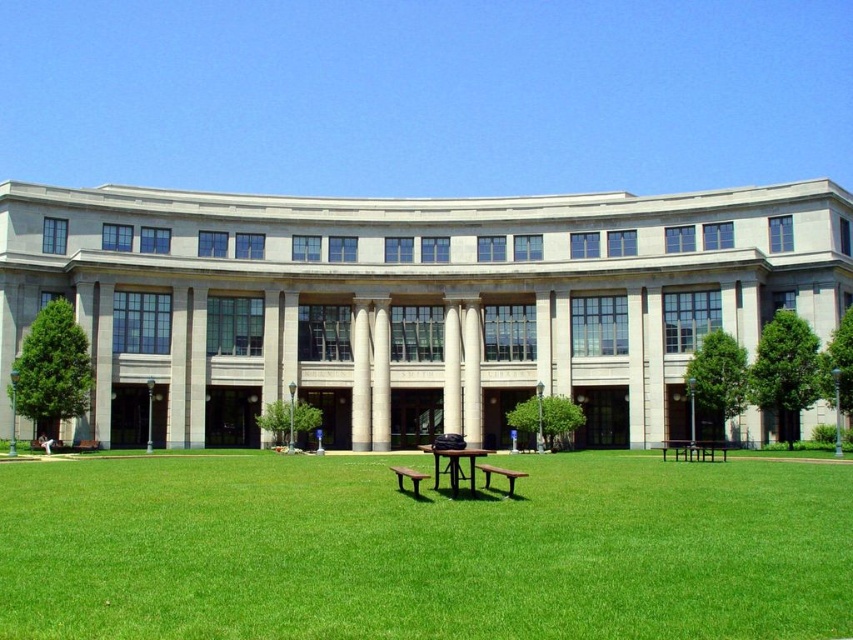
Which is in front, point (717, 444) or point (403, 467)?

Point (403, 467) is in front.

What are the coordinates of `brown wooden park bench at lower right` in the screenshot? It's located at (706, 449).

Where is `brown wooden park bench at lower right`? The width and height of the screenshot is (853, 640). brown wooden park bench at lower right is located at coordinates (706, 449).

Does brown wooden park bench at lower right lie in front of brown wooden bench at center?

No, brown wooden park bench at lower right is behind brown wooden bench at center.

Does brown wooden park bench at lower right appear over brown wooden bench at center?

Actually, brown wooden park bench at lower right is below brown wooden bench at center.

I want to click on brown wooden park bench at lower right, so click(x=706, y=449).

Is brown wooden park bench at center behind brown wooden bench at center?

Yes, it is.

Between brown wooden park bench at center and brown wooden bench at center, which one has less height?

brown wooden park bench at center is shorter.

Is point (680, 445) more distant than point (505, 476)?

Yes, point (680, 445) is farther from viewer.

Locate an element on the screen. brown wooden park bench at center is located at coordinates (677, 449).